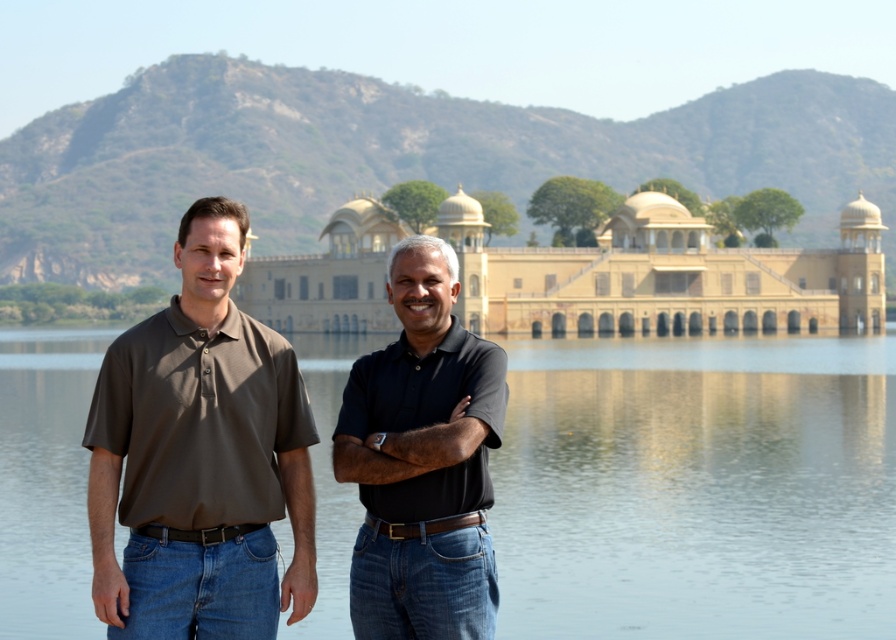
Does matte brown shirt at left appear under beige stone palace at center?

Correct, matte brown shirt at left is located below beige stone palace at center.

Does matte brown shirt at left have a lesser height compared to beige stone palace at center?

Correct, matte brown shirt at left is not as tall as beige stone palace at center.

This screenshot has width=896, height=640. What do you see at coordinates (200, 458) in the screenshot?
I see `matte brown shirt at left` at bounding box center [200, 458].

This screenshot has width=896, height=640. Identify the location of matte brown shirt at left. (200, 458).

Is clear water at center behind matte brown shirt at left?

That is True.

Does clear water at center have a lesser width compared to matte brown shirt at left?

No.

This screenshot has height=640, width=896. Identify the location of clear water at center. (696, 486).

Where is `clear water at center`? clear water at center is located at coordinates 696,486.